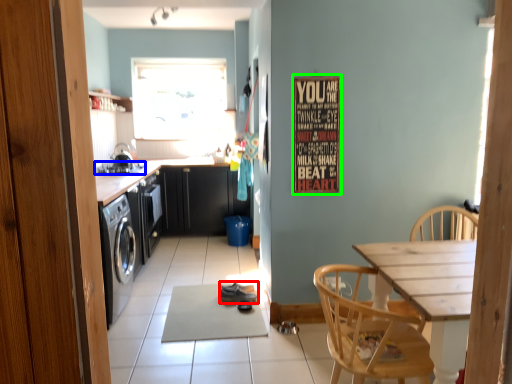
Question: Considering the real-world distances, which object is farthest from shoe (highlighted by a red box)? stove (highlighted by a blue box) or bulletin board (highlighted by a green box)?

Choices:
 (A) stove
 (B) bulletin board

Answer: (A)